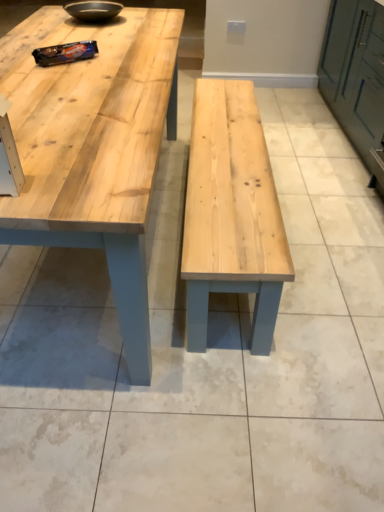
Question: Is green matte cabinet at right at the right side of natural wood table at center?

Choices:
 (A) yes
 (B) no

Answer: (A)

Question: Does green matte cabinet at right have a larger size compared to natural wood table at center?

Choices:
 (A) no
 (B) yes

Answer: (A)

Question: From a real-world perspective, is green matte cabinet at right on natural wood table at center?

Choices:
 (A) no
 (B) yes

Answer: (B)

Question: Is green matte cabinet at right positioned before natural wood table at center?

Choices:
 (A) yes
 (B) no

Answer: (B)

Question: Is green matte cabinet at right not near natural wood table at center?

Choices:
 (A) yes
 (B) no

Answer: (A)

Question: Can you confirm if green matte cabinet at right is smaller than natural wood table at center?

Choices:
 (A) yes
 (B) no

Answer: (A)

Question: From a real-world perspective, is green matte cabinet at right located higher than matte black bowl at upper center?

Choices:
 (A) yes
 (B) no

Answer: (B)

Question: Is green matte cabinet at right behind matte black bowl at upper center?

Choices:
 (A) no
 (B) yes

Answer: (A)

Question: From the image's perspective, does green matte cabinet at right appear lower than matte black bowl at upper center?

Choices:
 (A) yes
 (B) no

Answer: (A)

Question: Would you say matte black bowl at upper center is part of green matte cabinet at right's contents?

Choices:
 (A) no
 (B) yes

Answer: (A)

Question: Are green matte cabinet at right and matte black bowl at upper center far apart?

Choices:
 (A) yes
 (B) no

Answer: (A)

Question: Can you confirm if green matte cabinet at right is taller than matte black bowl at upper center?

Choices:
 (A) yes
 (B) no

Answer: (A)

Question: Is natural wood table at center aimed at green matte cabinet at right?

Choices:
 (A) yes
 (B) no

Answer: (B)